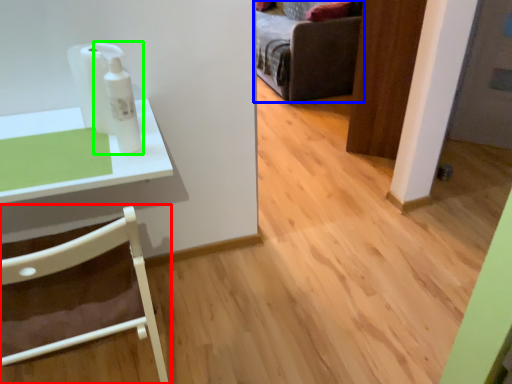
Question: Which object is the farthest from chair (highlighted by a red box)? Choose among these: furniture (highlighted by a blue box) or toiletry (highlighted by a green box).

Choices:
 (A) furniture
 (B) toiletry

Answer: (A)